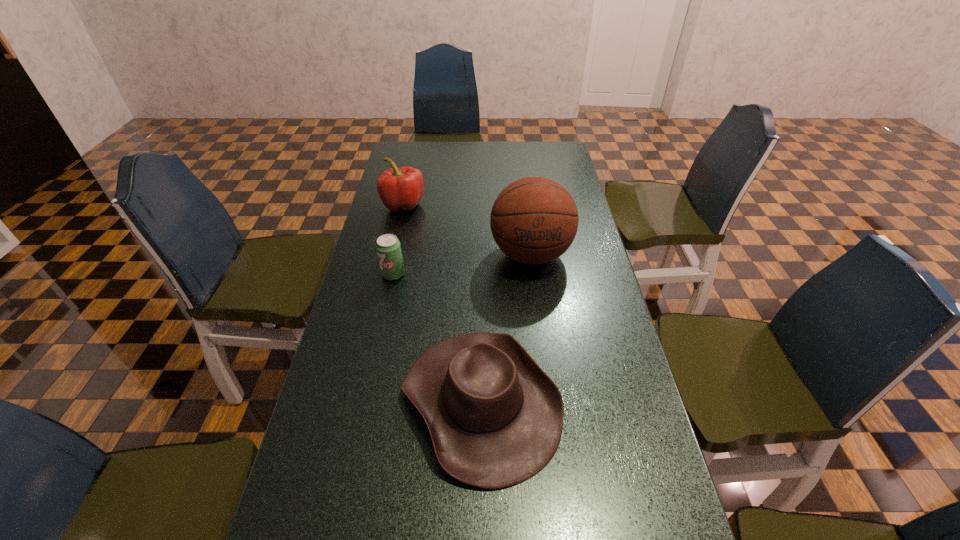
The height and width of the screenshot is (540, 960). Identify the location of soda situated at the left edge. (388, 248).

Where is `object situated at the right edge`? object situated at the right edge is located at coordinates (534, 220).

Identify the location of vacant space at the far edge of the desktop. This screenshot has width=960, height=540. (459, 149).

Image resolution: width=960 pixels, height=540 pixels. I want to click on free space at the left edge of the desktop, so click(309, 505).

I want to click on vacant position at the right edge of the desktop, so click(x=612, y=308).

I want to click on vacant space at the far left corner of the desktop, so point(407,159).

Where is `blank region between the tallest object and the third shortest object`? This screenshot has width=960, height=540. blank region between the tallest object and the third shortest object is located at coordinates (467, 230).

At what (x,y) coordinates should I click in order to perform the action: click on empty location between the farthest object and the cowboy hat. Please return your answer as a coordinate pair (x, y). Image resolution: width=960 pixels, height=540 pixels. Looking at the image, I should click on (443, 303).

Where is `free space between the second tallest object and the soda`? free space between the second tallest object and the soda is located at coordinates (398, 240).

Point out which object is positioned as the third nearest to the second tallest object. Please provide its 2D coordinates. Your answer should be formatted as a tuple, i.e. [(x, y)], where the tuple contains the x and y coordinates of a point satisfying the conditions above.

[(495, 418)]